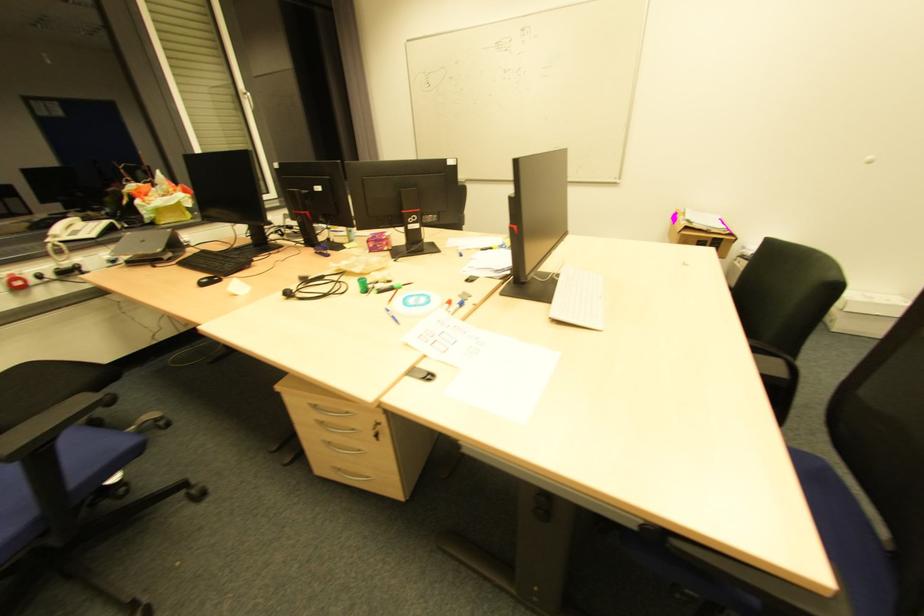
The image size is (924, 616). In order to click on white telephone handset in this screenshot , I will do `click(62, 221)`.